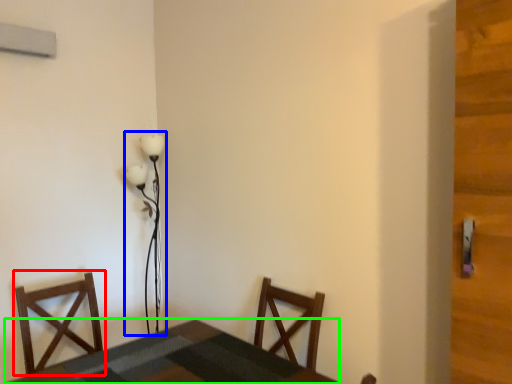
Question: Based on their relative distances, which object is nearer to chair (highlighted by a red box)? Choose from lamp (highlighted by a blue box) and table (highlighted by a green box).

Choices:
 (A) lamp
 (B) table

Answer: (B)